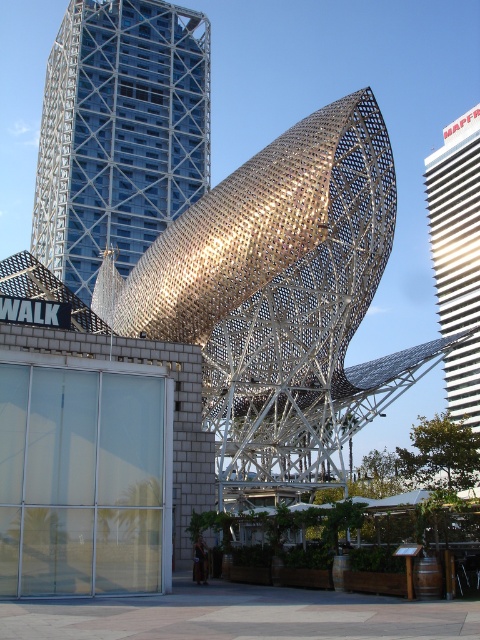
From the picture: You are standing in the urban scene and want to take a photo of both the blue glassy tower at upper left and the white glossy tower at right. Which tower should you focus on first to ensure both are in the frame?

You should focus on the blue glassy tower at upper left first because it is closer to you than the white glossy tower at right, so adjusting the camera to include the closer tower will also capture the distant one.

You are standing in the urban scene and want to take a photo of both the blue glassy tower at upper left and the white glossy tower at right. Which tower should you frame first in your camera to ensure both are fully visible in the photo?

You should frame the blue glassy tower at upper left first because its width is larger than the white glossy tower at right, so capturing it first ensures there is enough space for both in the photo.

You are standing in the middle of the urban scene and want to take a photo of both the blue glassy tower at upper left and the white glossy tower at right. Which tower should you position to your left side to capture both in the frame?

The blue glassy tower at upper left is positioned on the left side of white glossy tower at right, so to capture both in the frame, you should position the blue glassy tower at upper left to your left side and the white glossy tower at right to your right side.